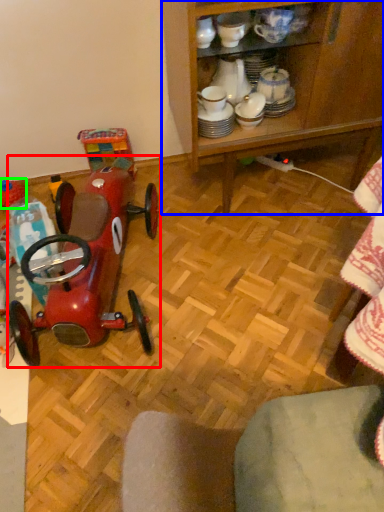
Question: Based on their relative distances, which object is nearer to toy (highlighted by a red box)? Choose from cabinetry (highlighted by a blue box) and toy (highlighted by a green box).

Choices:
 (A) cabinetry
 (B) toy

Answer: (B)